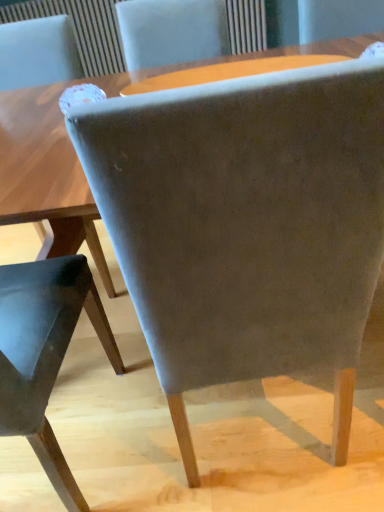
Question: From a real-world perspective, is suede-like gray chair at center, which is counted as the 1th chair, starting from the right, on top of matte wooden table at upper center?

Choices:
 (A) no
 (B) yes

Answer: (A)

Question: Considering the relative sizes of suede-like gray chair at center, the 2th chair viewed from the left, and matte wooden table at upper center in the image provided, is suede-like gray chair at center, the 2th chair viewed from the left, thinner than matte wooden table at upper center?

Choices:
 (A) no
 (B) yes

Answer: (A)

Question: Considering the relative sizes of suede-like gray chair at center, which is counted as the 1th chair, starting from the right, and matte wooden table at upper center in the image provided, is suede-like gray chair at center, which is counted as the 1th chair, starting from the right, bigger than matte wooden table at upper center?

Choices:
 (A) yes
 (B) no

Answer: (A)

Question: Does suede-like gray chair at center, the 2th chair viewed from the left, appear on the left side of matte wooden table at upper center?

Choices:
 (A) yes
 (B) no

Answer: (A)

Question: Are suede-like gray chair at center, the 2th chair viewed from the left, and matte wooden table at upper center located far from each other?

Choices:
 (A) no
 (B) yes

Answer: (A)

Question: In the image, is suede gray chair at center, the second chair positioned from the right, positioned in front of or behind matte wooden table at upper center?

Choices:
 (A) front
 (B) behind

Answer: (A)

Question: Considering the positions of suede gray chair at center, the second chair positioned from the right, and matte wooden table at upper center in the image, is suede gray chair at center, the second chair positioned from the right, taller or shorter than matte wooden table at upper center?

Choices:
 (A) tall
 (B) short

Answer: (A)

Question: Based on their positions, is suede gray chair at center, the second chair positioned from the right, located to the left or right of matte wooden table at upper center?

Choices:
 (A) left
 (B) right

Answer: (A)

Question: Is suede gray chair at center, the first chair viewed from the left, inside or outside of matte wooden table at upper center?

Choices:
 (A) inside
 (B) outside

Answer: (B)

Question: Is suede-like gray chair at center, which is counted as the 1th chair, starting from the right, inside the boundaries of matte wooden table at upper center, or outside?

Choices:
 (A) inside
 (B) outside

Answer: (B)

Question: From the image's perspective, is suede-like gray chair at center, which is counted as the 1th chair, starting from the right, positioned above or below matte wooden table at upper center?

Choices:
 (A) above
 (B) below

Answer: (B)

Question: From their relative heights in the image, would you say suede-like gray chair at center, which is counted as the 1th chair, starting from the right, is taller or shorter than matte wooden table at upper center?

Choices:
 (A) short
 (B) tall

Answer: (B)

Question: Considering the positions of suede-like gray chair at center, which is counted as the 1th chair, starting from the right, and matte wooden table at upper center in the image, is suede-like gray chair at center, which is counted as the 1th chair, starting from the right, bigger or smaller than matte wooden table at upper center?

Choices:
 (A) small
 (B) big

Answer: (B)

Question: Considering the positions of matte wooden table at upper center and suede gray chair at center, the first chair viewed from the left, in the image, is matte wooden table at upper center bigger or smaller than suede gray chair at center, the first chair viewed from the left,?

Choices:
 (A) big
 (B) small

Answer: (B)

Question: Considering their positions, is matte wooden table at upper center located in front of or behind suede gray chair at center, the second chair positioned from the right?

Choices:
 (A) behind
 (B) front

Answer: (A)